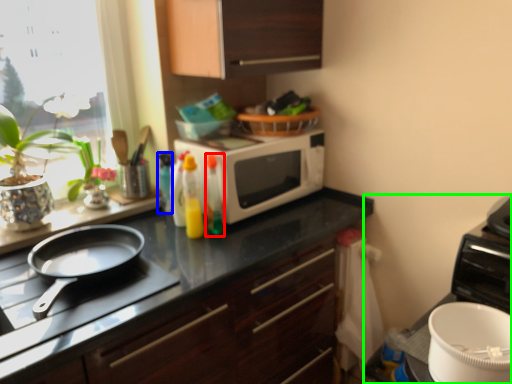
Question: Which object is the farthest from bottle (highlighted by a red box)? Choose among these: bottle (highlighted by a blue box) or appliance (highlighted by a green box).

Choices:
 (A) bottle
 (B) appliance

Answer: (B)